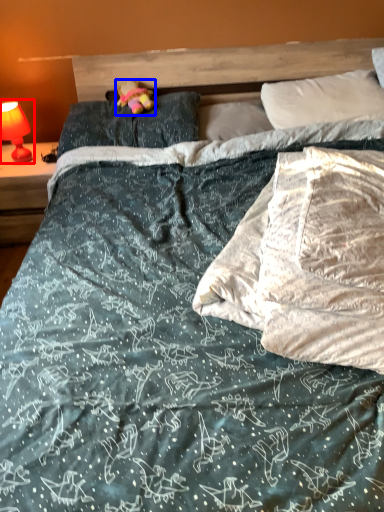
Question: Which object is closer to the camera taking this photo, bedside lamp (highlighted by a red box) or figurine (highlighted by a blue box)?

Choices:
 (A) bedside lamp
 (B) figurine

Answer: (B)